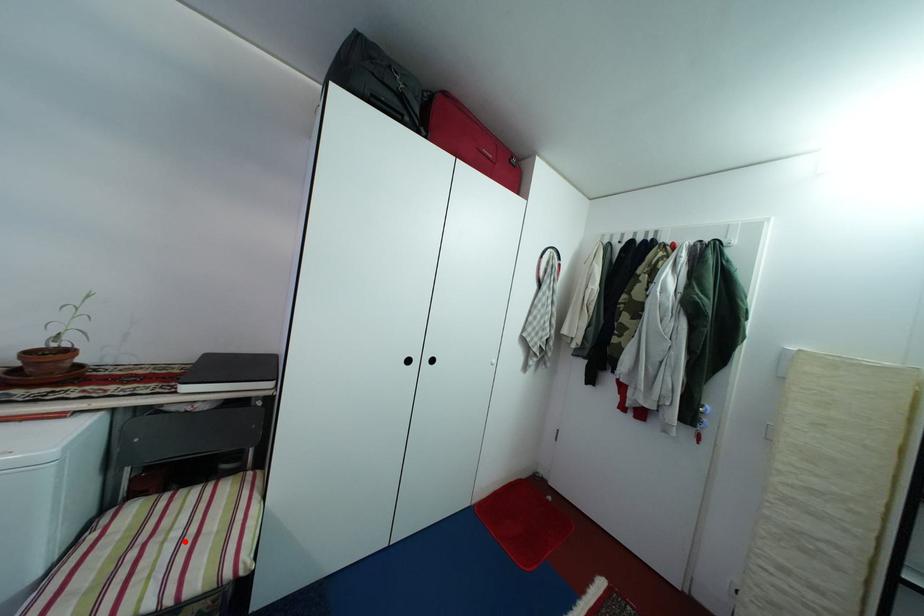
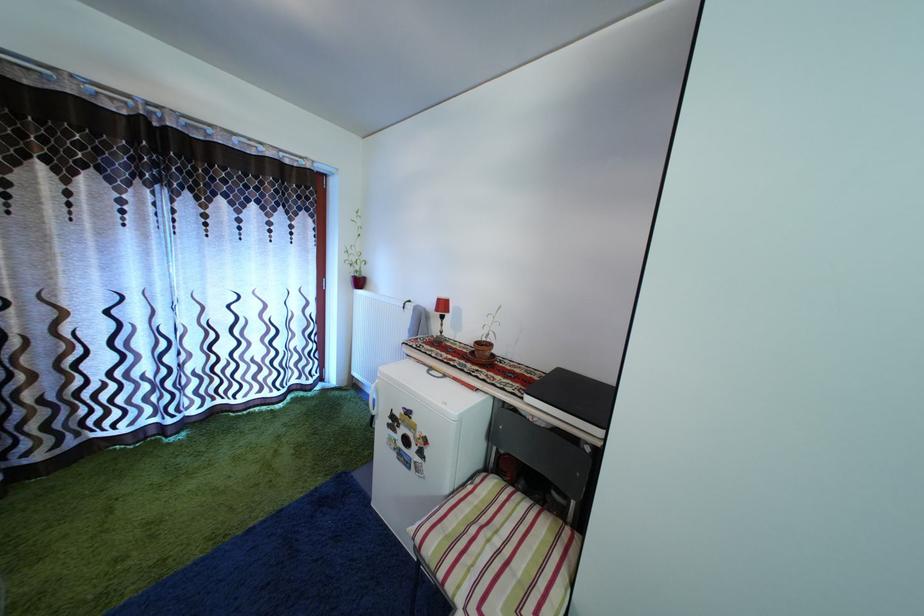
Question: I am providing you with two images of the same scene from different viewpoints. A red point is marked on the first image. Is the red point's position out of view in image 2?

Choices:
 (A) Yes
 (B) No

Answer: (B)